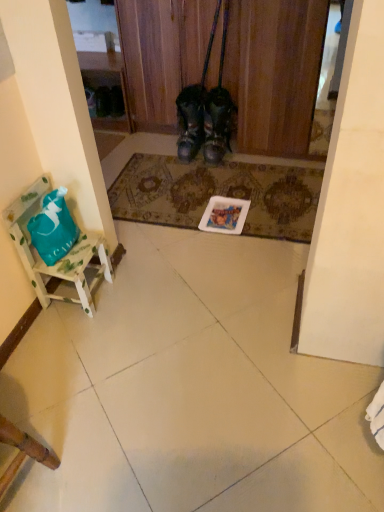
Question: From the image's perspective, does black leather boots at center appear lower than white wood chair at left?

Choices:
 (A) yes
 (B) no

Answer: (B)

Question: From a real-world perspective, is black leather boots at center located beneath white wood chair at left?

Choices:
 (A) yes
 (B) no

Answer: (B)

Question: Is black leather boots at center positioned far away from white wood chair at left?

Choices:
 (A) no
 (B) yes

Answer: (B)

Question: From a real-world perspective, is black leather boots at center physically above white wood chair at left?

Choices:
 (A) yes
 (B) no

Answer: (A)

Question: Is black leather boots at center positioned before white wood chair at left?

Choices:
 (A) yes
 (B) no

Answer: (B)

Question: Relative to leather boots at center, which is the second footwear from left to right, is patterned carpet at center in front or behind?

Choices:
 (A) front
 (B) behind

Answer: (A)

Question: Visually, is patterned carpet at center positioned to the left or to the right of leather boots at center, which is the second footwear from left to right?

Choices:
 (A) right
 (B) left

Answer: (B)

Question: From the image's perspective, is patterned carpet at center located above or below leather boots at center, the first footwear in the right-to-left sequence?

Choices:
 (A) below
 (B) above

Answer: (A)

Question: Considering the positions of patterned carpet at center and leather boots at center, the first footwear in the right-to-left sequence, in the image, is patterned carpet at center bigger or smaller than leather boots at center, the first footwear in the right-to-left sequence,?

Choices:
 (A) big
 (B) small

Answer: (B)

Question: Based on their sizes in the image, would you say leather boots at center, which is the second footwear from left to right, is bigger or smaller than leather boots at center, the second footwear viewed from the right?

Choices:
 (A) small
 (B) big

Answer: (A)

Question: Considering the positions of leather boots at center, which is the second footwear from left to right, and leather boots at center, the first footwear viewed from the left, in the image, is leather boots at center, which is the second footwear from left to right, wider or thinner than leather boots at center, the first footwear viewed from the left,?

Choices:
 (A) thin
 (B) wide

Answer: (B)

Question: From the image's perspective, relative to leather boots at center, the second footwear viewed from the right, is leather boots at center, which is the second footwear from left to right, above or below?

Choices:
 (A) below
 (B) above

Answer: (A)

Question: Is leather boots at center, the first footwear in the right-to-left sequence, to the left or to the right of leather boots at center, the second footwear viewed from the right, in the image?

Choices:
 (A) right
 (B) left

Answer: (A)

Question: Which is correct: white wood chair at left is inside leather boots at center, the first footwear in the right-to-left sequence, or outside of it?

Choices:
 (A) outside
 (B) inside

Answer: (A)

Question: Is white wood chair at left in front of or behind leather boots at center, the first footwear in the right-to-left sequence, in the image?

Choices:
 (A) behind
 (B) front

Answer: (B)